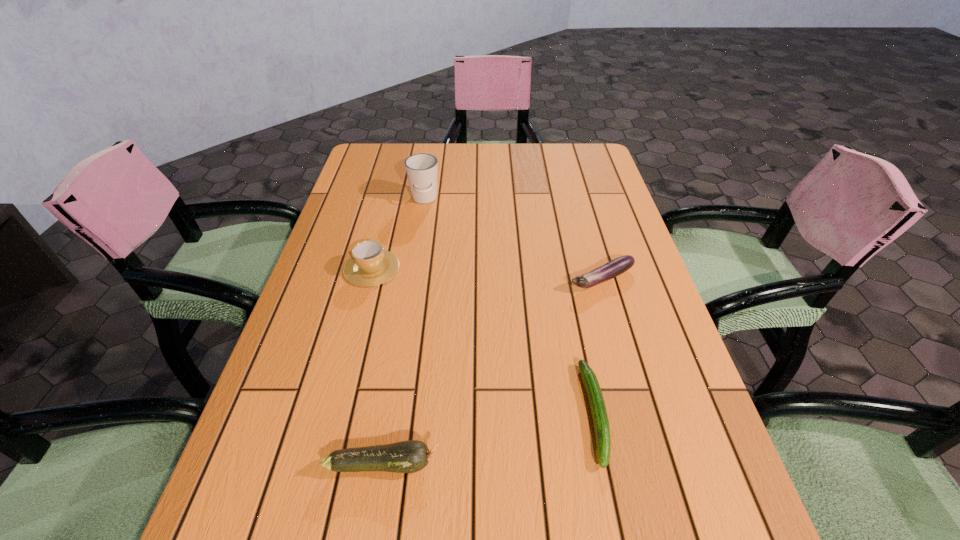
Find the location of a particular element. empty space that is in between the farther cup and the taller zucchini is located at coordinates (404, 331).

You are a GUI agent. You are given a task and a screenshot of the screen. Output one action in this format:
    pyautogui.click(x=<x>, y=<y>)
    Task: Click on the vacant region between the fourth tallest object and the taller zucchini
    Image resolution: width=960 pixels, height=540 pixels.
    Given the screenshot: What is the action you would take?
    pyautogui.click(x=492, y=372)

The height and width of the screenshot is (540, 960). I want to click on object that is the closest to the shorter zucchini, so tap(617, 266).

Identify which object is the fourth closest to the shortest object. Please provide its 2D coordinates. Your answer should be formatted as a tuple, i.e. [(x, y)], where the tuple contains the x and y coordinates of a point satisfying the conditions above.

[(421, 168)]

In order to click on free spot that satisfies the following two spatial constraints: 1. with a handle on the side of the fourth tallest object; 2. on the right side of the farther cup in this screenshot , I will do `click(412, 279)`.

Locate an element on the screen. free location that satisfies the following two spatial constraints: 1. with a handle on the side of the fourth tallest object; 2. on the left side of the tallest object is located at coordinates (412, 279).